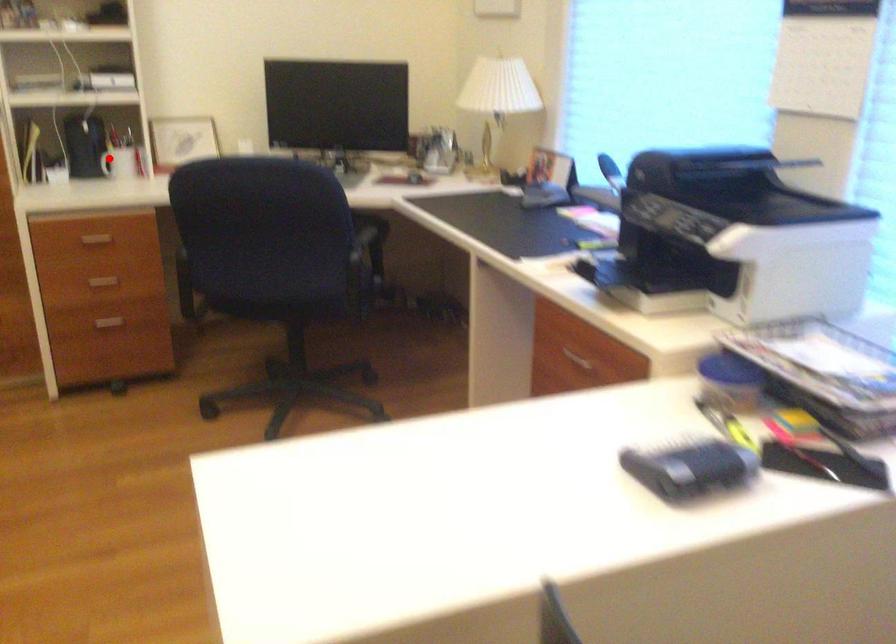
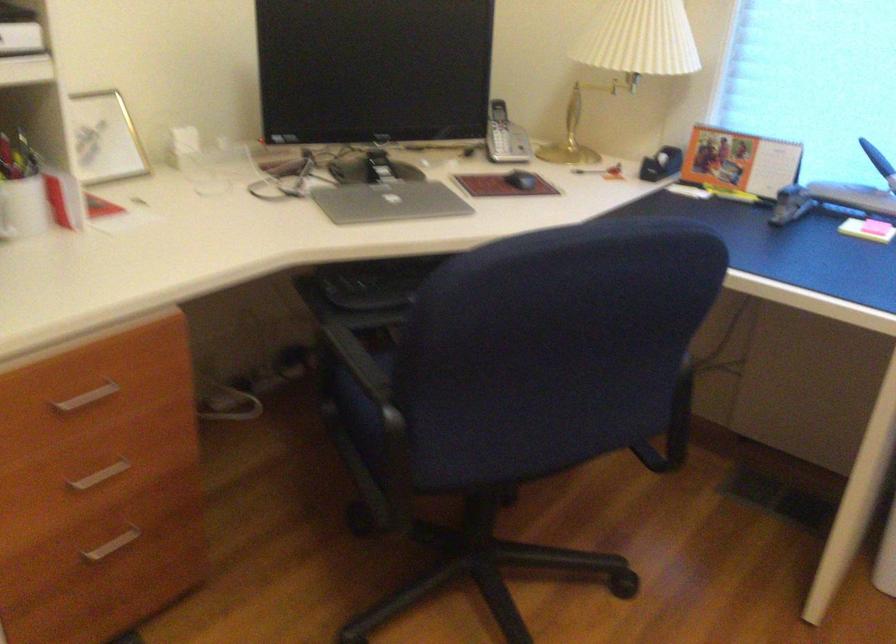
Question: I am providing you with two images of the same scene from different viewpoints. Given a red point in image1, look at the same physical point in image2. Is it:

Choices:
 (A) Closer to the viewpoint
 (B) Farther from the viewpoint

Answer: (A)